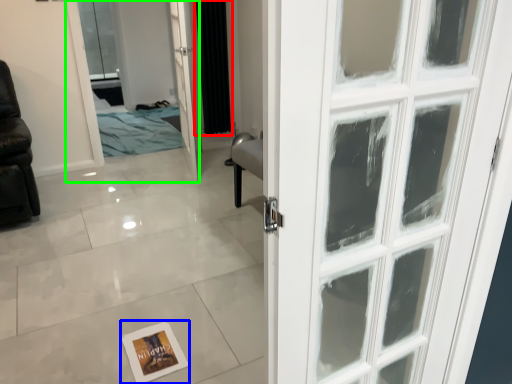
Question: Based on their relative distances, which object is nearer to curtain (highlighted by a red box)? Choose from postcard (highlighted by a blue box) and elevator (highlighted by a green box).

Choices:
 (A) postcard
 (B) elevator

Answer: (B)